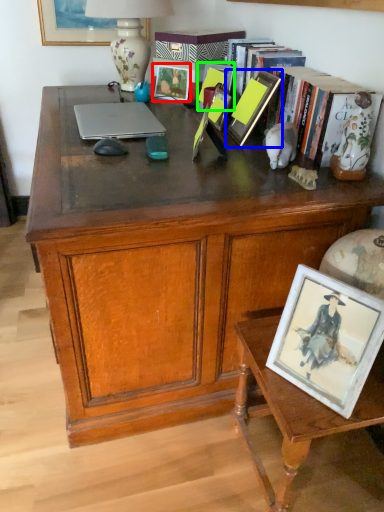
Question: Considering the real-world distances, which object is closest to picture frame (highlighted by a red box)? picture frame (highlighted by a blue box) or picture frame (highlighted by a green box).

Choices:
 (A) picture frame
 (B) picture frame

Answer: (B)